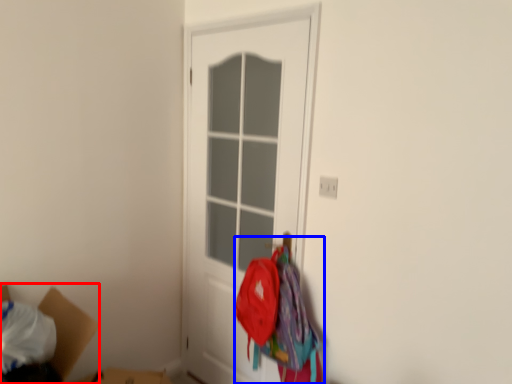
Question: Among these objects, which one is nearest to the camera, cardboard box (highlighted by a red box) or laundry (highlighted by a blue box)?

Choices:
 (A) cardboard box
 (B) laundry

Answer: (A)